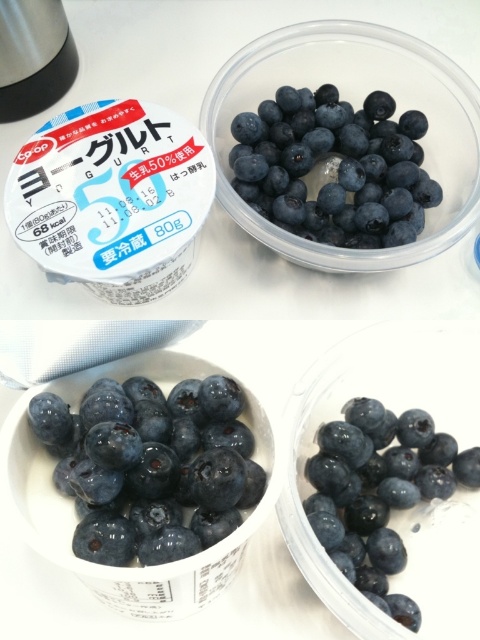
Does glossy blueberry at center have a greater height compared to blueberry at center?

Incorrect, glossy blueberry at center's height is not larger of blueberry at center's.

This screenshot has height=640, width=480. I want to click on glossy blueberry at center, so click(x=151, y=465).

In order to click on glossy blueberry at center in this screenshot , I will do `click(151, 465)`.

Can you confirm if blueberry at center is bigger than shiny blueberry at center?

Correct, blueberry at center is larger in size than shiny blueberry at center.

Is blueberry at center in front of shiny blueberry at center?

No.

I want to click on blueberry at center, so click(x=336, y=170).

Does point (81, 449) come behind point (339, 509)?

No, it is in front of (339, 509).

How far apart are glossy blueberry at center and shiny blueberry at center?

glossy blueberry at center and shiny blueberry at center are 6.94 inches apart from each other.

Measure the distance between glossy blueberry at center and camera.

The distance of glossy blueberry at center from camera is 20.41 inches.

You are a GUI agent. You are given a task and a screenshot of the screen. Output one action in this format:
    pyautogui.click(x=<x>, y=<y>)
    Task: Click on the glossy blueberry at center
    The width and height of the screenshot is (480, 640).
    Given the screenshot: What is the action you would take?
    pyautogui.click(x=151, y=465)